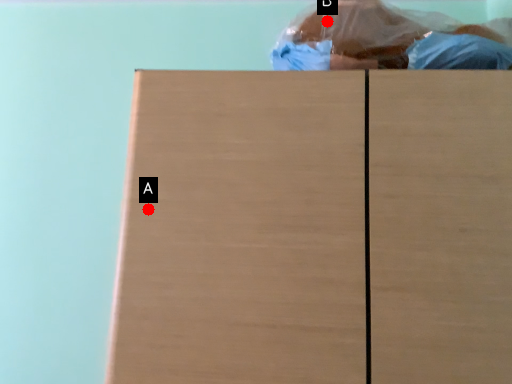
Question: Two points are circled on the image, labeled by A and B beside each circle. Which point appears closest to the camera in this image?

Choices:
 (A) A is closer
 (B) B is closer

Answer: (A)